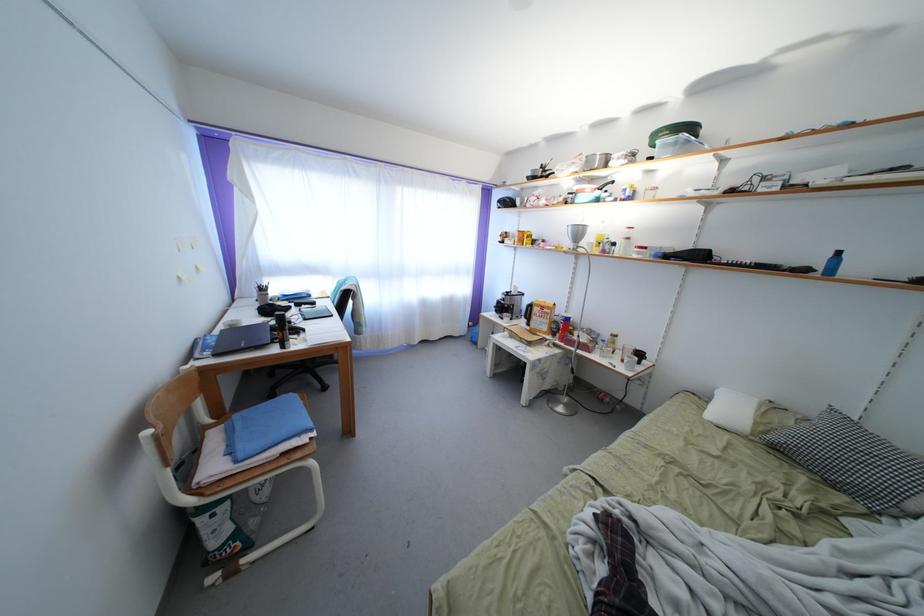
At what (x,y) coordinates should I click in order to perform the action: click on black spray bottle. Please return your answer as a coordinate pair (x, y). Looking at the image, I should click on (282, 330).